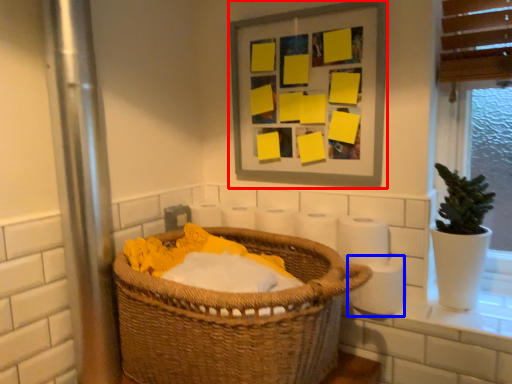
Question: Which of the following is the closest to the observer, picture frame (highlighted by a red box) or toilet paper (highlighted by a blue box)?

Choices:
 (A) picture frame
 (B) toilet paper

Answer: (B)